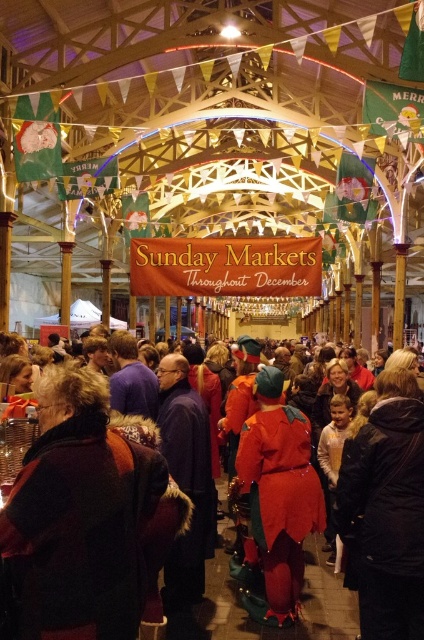
Question: Is dark brown fur coat at center to the left of shiny red costume at center from the viewer's perspective?

Choices:
 (A) yes
 (B) no

Answer: (A)

Question: Is dark brown fur coat at center further to the viewer compared to shiny red costume at center?

Choices:
 (A) no
 (B) yes

Answer: (A)

Question: Among these objects, which one is nearest to the camera?

Choices:
 (A) shiny red costume at center
 (B) dark brown fur coat at center

Answer: (B)

Question: Which object appears closest to the camera in this image?

Choices:
 (A) dark brown fur coat at center
 (B) shiny red costume at center

Answer: (A)

Question: Which object appears closest to the camera in this image?

Choices:
 (A) shiny red costume at center
 (B) dark brown fur coat at center

Answer: (B)

Question: Is dark brown fur coat at center above shiny red costume at center?

Choices:
 (A) yes
 (B) no

Answer: (A)